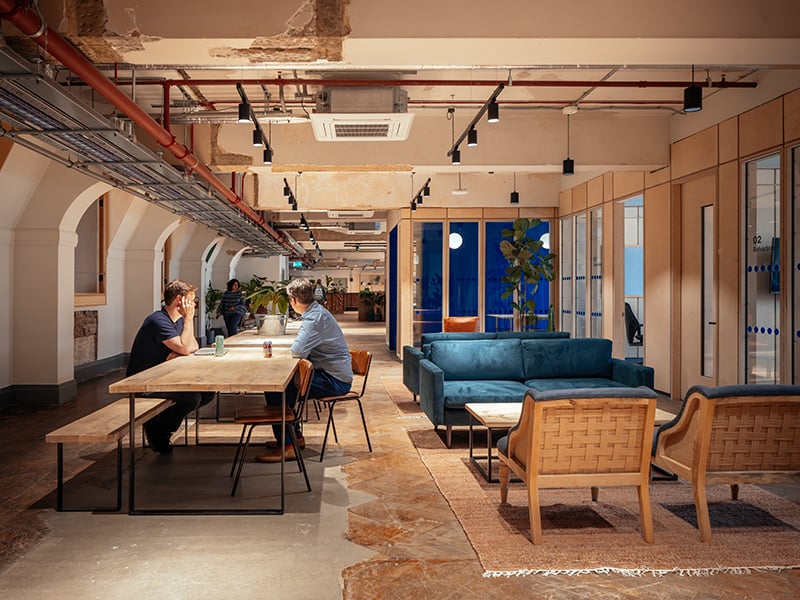
Identify the location of rug. (494, 542).